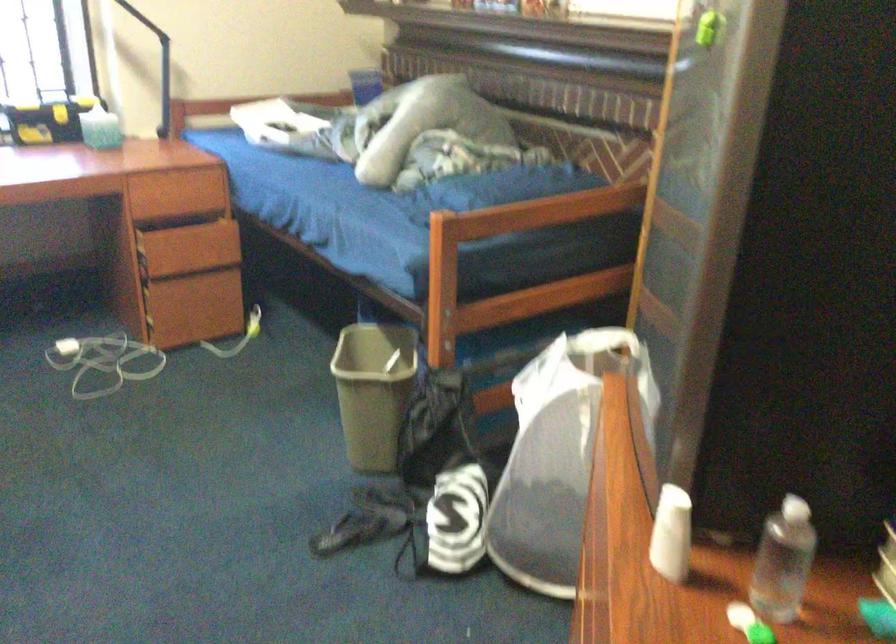
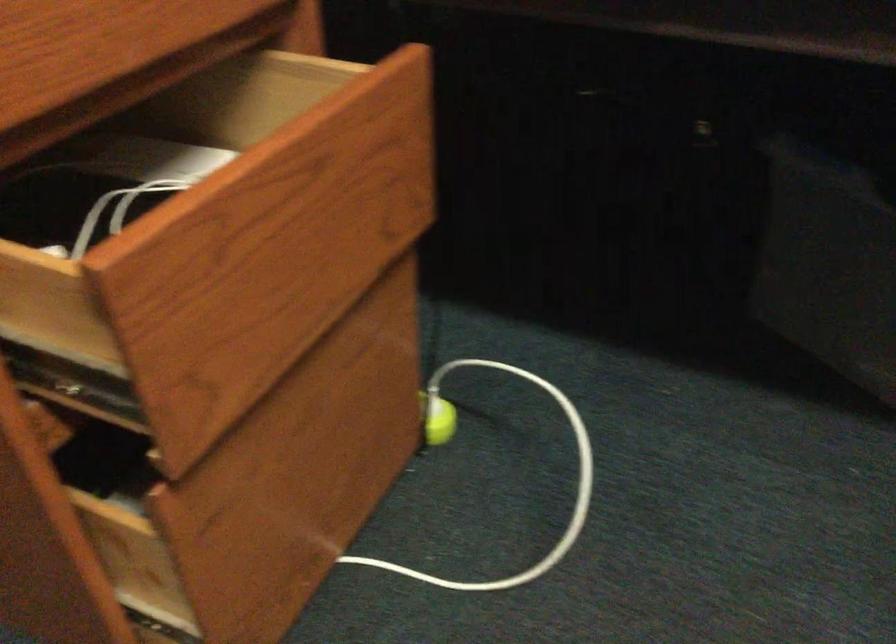
Locate, in the second image, the point that corresponds to [231,219] in the first image.

(323, 62)